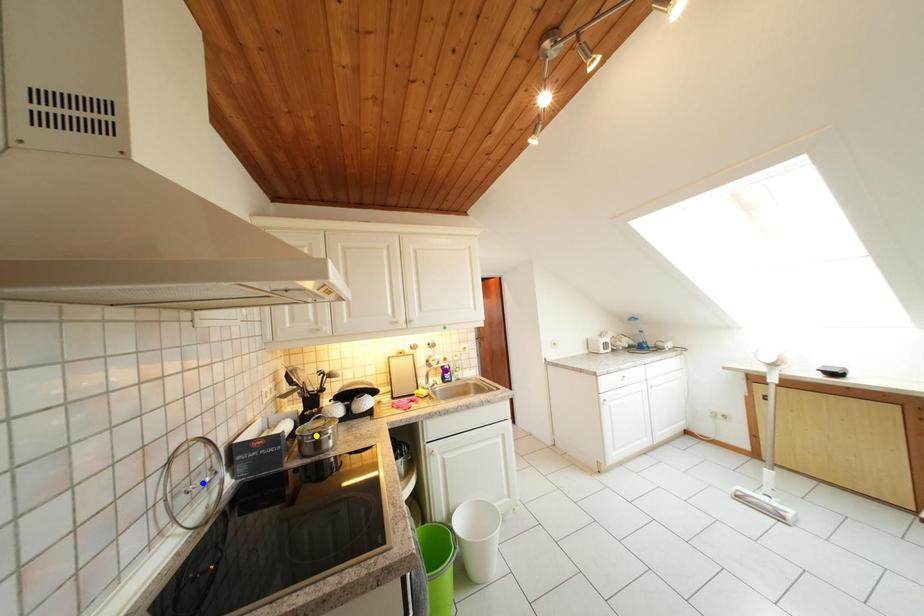
Order these from farthest to nearest:
purple point
blue point
yellow point

1. purple point
2. yellow point
3. blue point